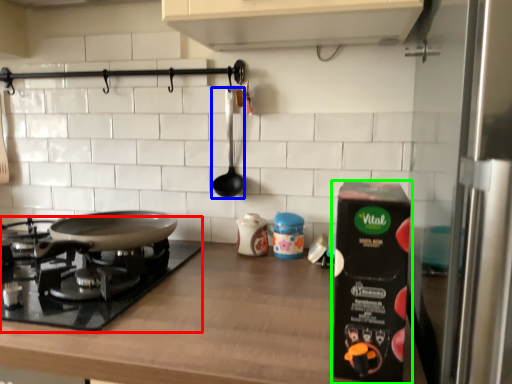
Question: Based on their relative distances, which object is nearer to gas stove (highlighted by a red box)? Choose from utensil (highlighted by a blue box) and kitchen appliance (highlighted by a green box).

Choices:
 (A) utensil
 (B) kitchen appliance

Answer: (A)